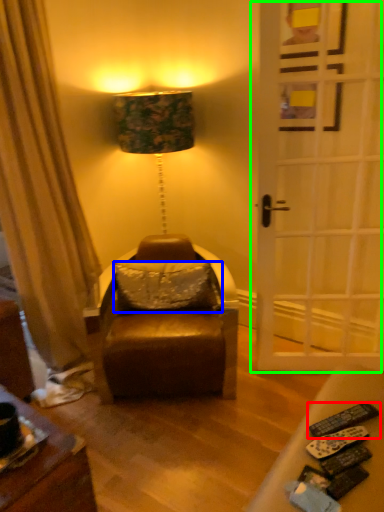
Question: Which is farther away from remote control (highlighted by a red box)? pillow (highlighted by a blue box) or door (highlighted by a green box)?

Choices:
 (A) pillow
 (B) door

Answer: (B)